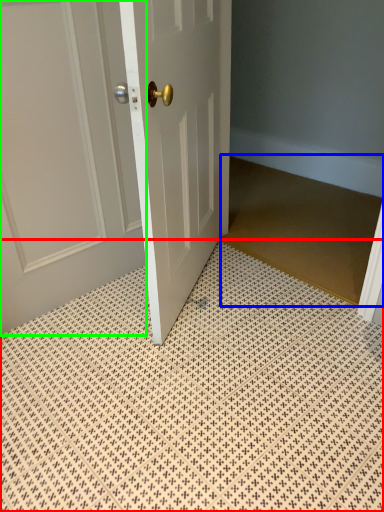
Question: Which object is positioned closest to bath mat (highlighted by a red box)? Select from doormat (highlighted by a blue box) and door (highlighted by a green box).

Choices:
 (A) doormat
 (B) door

Answer: (B)